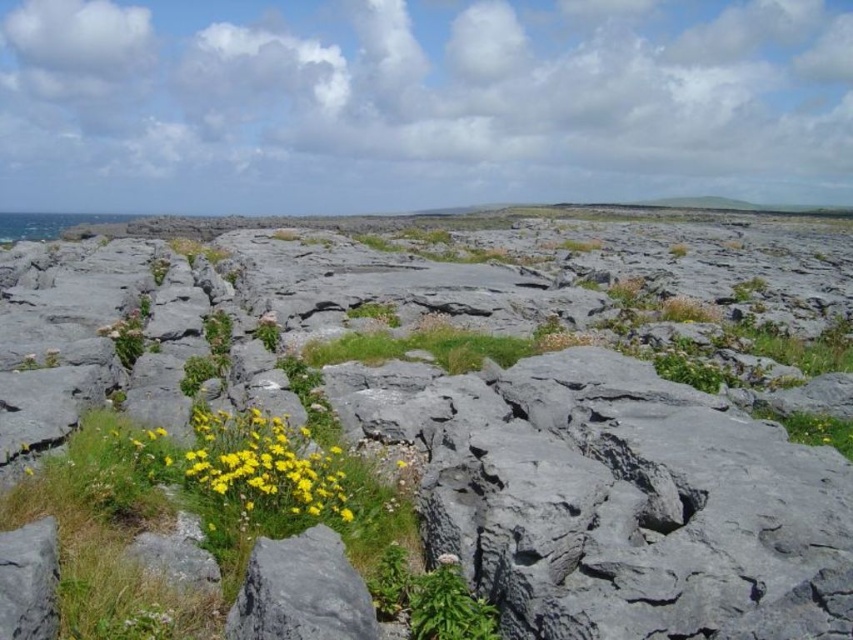
Question: Which point is closer to the camera taking this photo?

Choices:
 (A) (244, 444)
 (B) (450, 368)
 (C) (231, 604)
 (D) (498, 392)

Answer: (C)

Question: Considering the real-world distances, which object is farthest from the gray rough rock at center?

Choices:
 (A) yellow matte flower at lower left
 (B) gray rough rock at lower center

Answer: (B)

Question: Where is yellow matte flower at lower left located in relation to gray rough rock at lower center in the image?

Choices:
 (A) left
 (B) right

Answer: (A)

Question: Which object is closer to the camera taking this photo?

Choices:
 (A) gray rough rock at lower center
 (B) yellow matte flower at lower left
 (C) green grass at center
 (D) gray rough rock at center

Answer: (D)

Question: Can you confirm if yellow matte flower at lower left is positioned below green grass at center?

Choices:
 (A) no
 (B) yes

Answer: (B)

Question: Is gray rough rock at lower center to the left of green grass at center from the viewer's perspective?

Choices:
 (A) no
 (B) yes

Answer: (B)